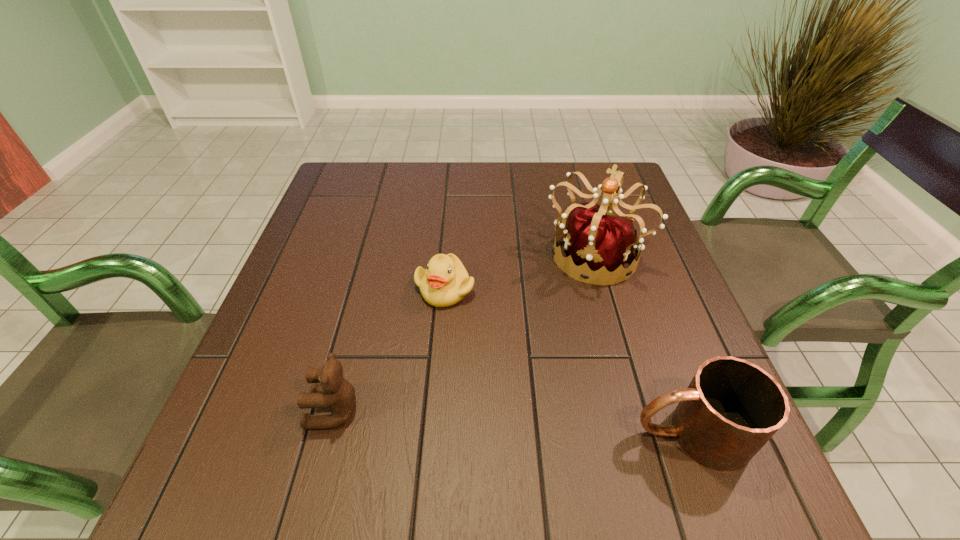
Identify the location of mug present at the right edge. (731, 408).

Locate an element on the screen. This screenshot has height=540, width=960. tiara positioned at the right edge is located at coordinates (598, 239).

The height and width of the screenshot is (540, 960). I want to click on object located in the near left corner section of the desktop, so click(x=335, y=392).

What are the coordinates of `object present at the near right corner` in the screenshot? It's located at (731, 408).

In the image, there is a desktop. Find the location of `vacant space at the far edge`. vacant space at the far edge is located at coordinates (482, 176).

The height and width of the screenshot is (540, 960). I want to click on free space at the near edge of the desktop, so click(x=353, y=426).

This screenshot has height=540, width=960. In the image, there is a desktop. Find the location of `vacant space at the left edge`. vacant space at the left edge is located at coordinates (288, 349).

Where is `blank space at the right edge`? The image size is (960, 540). blank space at the right edge is located at coordinates (664, 291).

Identify the location of blank space at the far left corner of the desktop. (341, 200).

At what (x,y) coordinates should I click in order to perform the action: click on vacant space at the far right corner of the desktop. Please return your answer as a coordinate pair (x, y). Looking at the image, I should click on (574, 172).